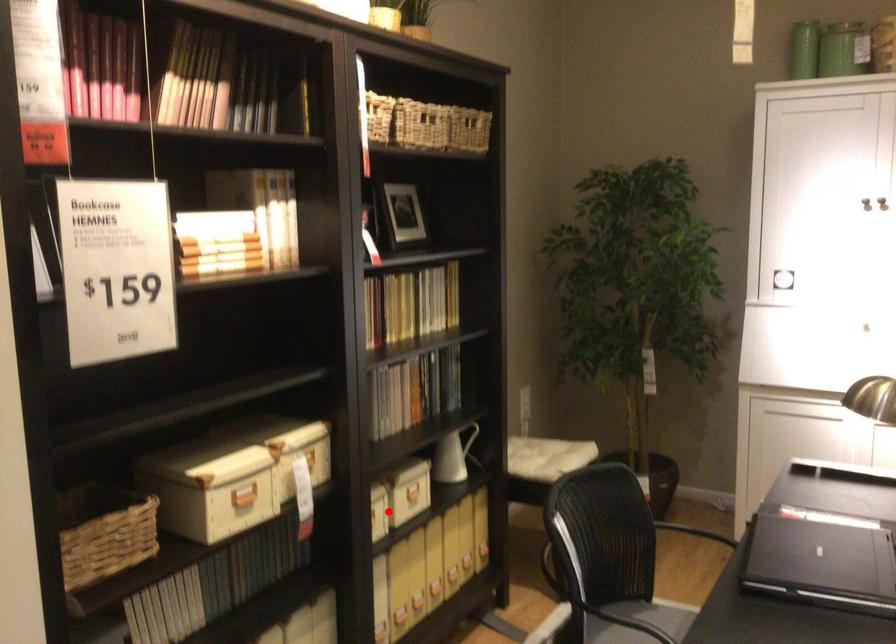
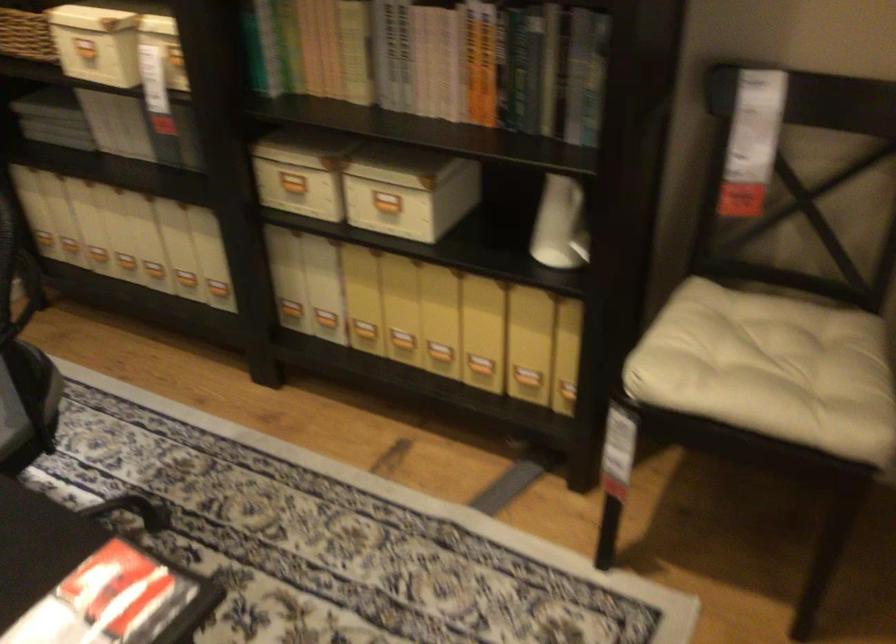
Locate, in the second image, the point that corresponds to the highlighted location in the first image.

(386, 204)